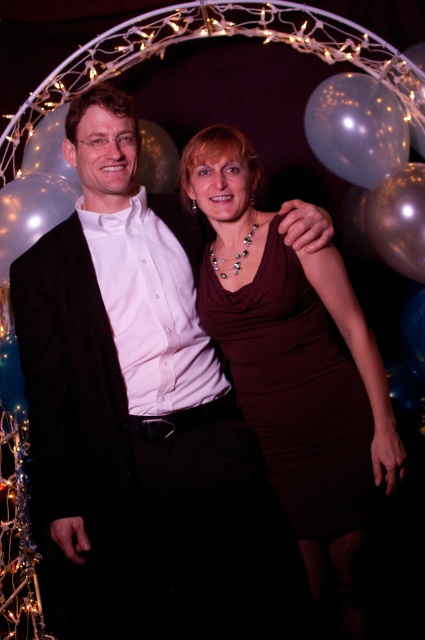
You are a photographer setting up for a photoshoot. You need to ensure the burgundy satin dress at center and the transparent plastic balloon at left are both visible in the frame. Given their sizes, which object will require more space in the camera frame?

The burgundy satin dress at center is bigger than the transparent plastic balloon at left, so it will require more space in the camera frame.